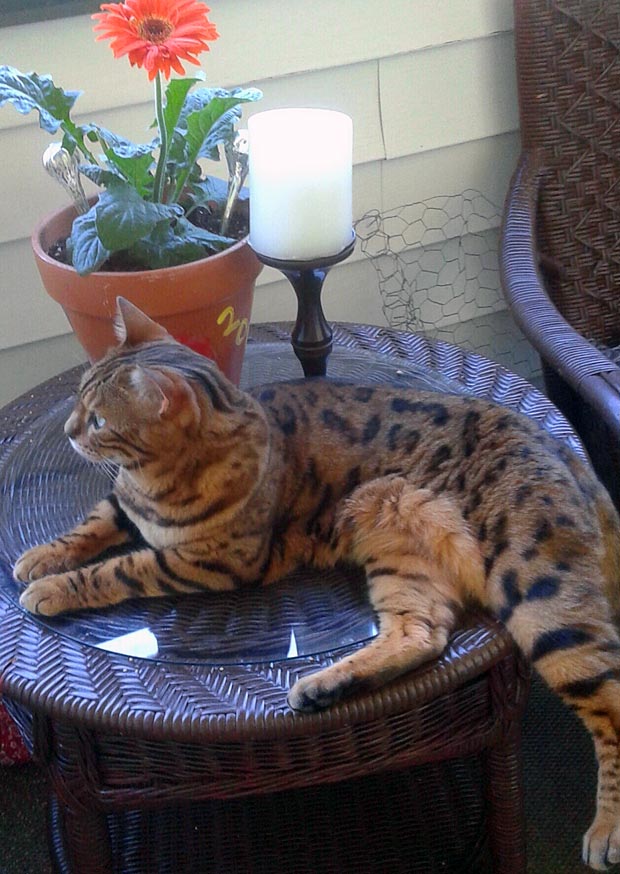
Identify the location of candle. (304, 203).